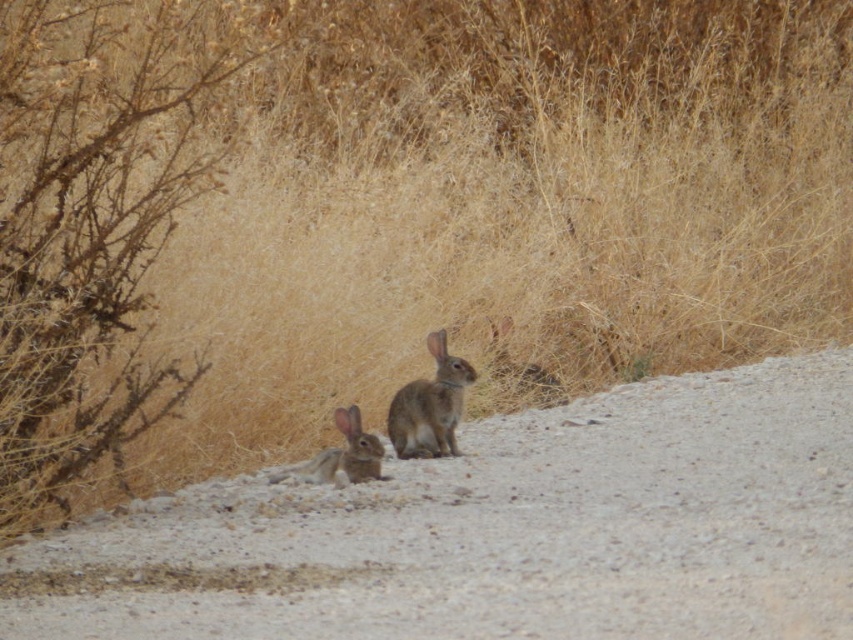
You are a photographer trying to capture both the gray gravel road at center and the furry brown rabbit at center in a single shot. Based on their positions, which object will appear closer to the camera in your photo?

The gray gravel road at center appears closer to the camera because it is positioned in front of the furry brown rabbit at center.

You are a photographer trying to capture a clear photo of the fuzzy brown rabbit at center. However, the brown dry bush at left is blocking your view. Can you determine if the bush is in front of or behind the rabbit?

The brown dry bush at left is positioned over the fuzzy brown rabbit at center, meaning the bush is in front of the rabbit and blocking the view.